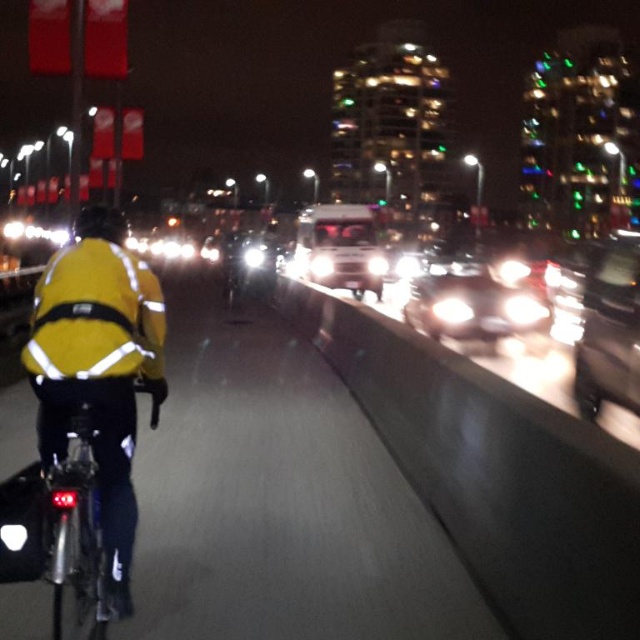
Does reflective plastic bicycle at left have a greater height compared to shiny silver sedan at center?

No, reflective plastic bicycle at left is not taller than shiny silver sedan at center.

Locate an element on the screen. The width and height of the screenshot is (640, 640). reflective plastic bicycle at left is located at coordinates (58, 531).

Is point (100, 548) closer to camera compared to point (515, 300)?

Yes, it is in front of point (515, 300).

Find the location of a particular element. reflective plastic bicycle at left is located at coordinates (58, 531).

Who is positioned more to the left, reflective plastic bicycle at left or shiny silver sedan at right?

Positioned to the left is reflective plastic bicycle at left.

Is reflective plastic bicycle at left to the right of shiny silver sedan at right from the viewer's perspective?

Incorrect, reflective plastic bicycle at left is not on the right side of shiny silver sedan at right.

Where is `reflective plastic bicycle at left`? This screenshot has height=640, width=640. reflective plastic bicycle at left is located at coordinates point(58,531).

Who is lower down, yellow reflective jacket at center or yellow reflective helmet at upper left?

Positioned lower is yellow reflective jacket at center.

The image size is (640, 640). What are the coordinates of `yellow reflective jacket at center` in the screenshot? It's located at (278, 500).